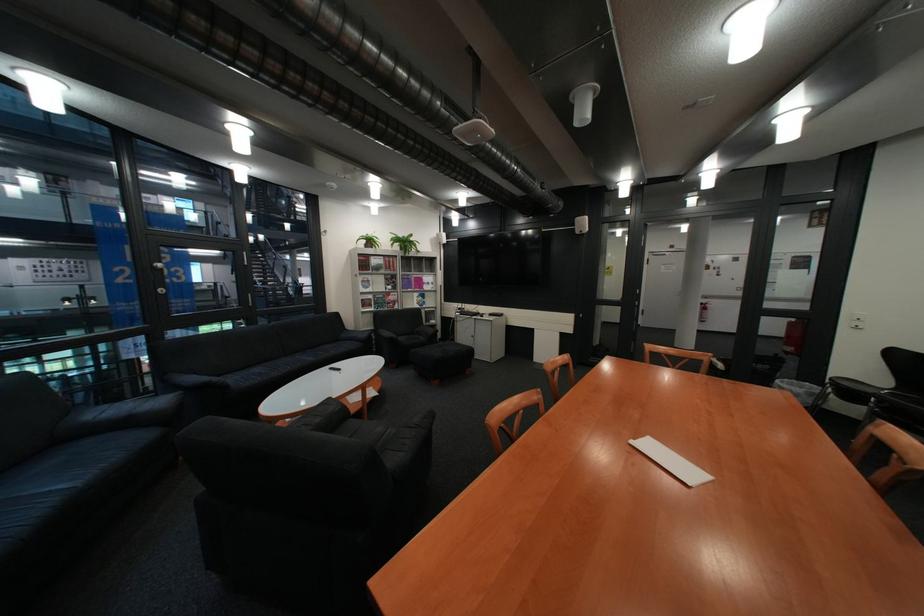
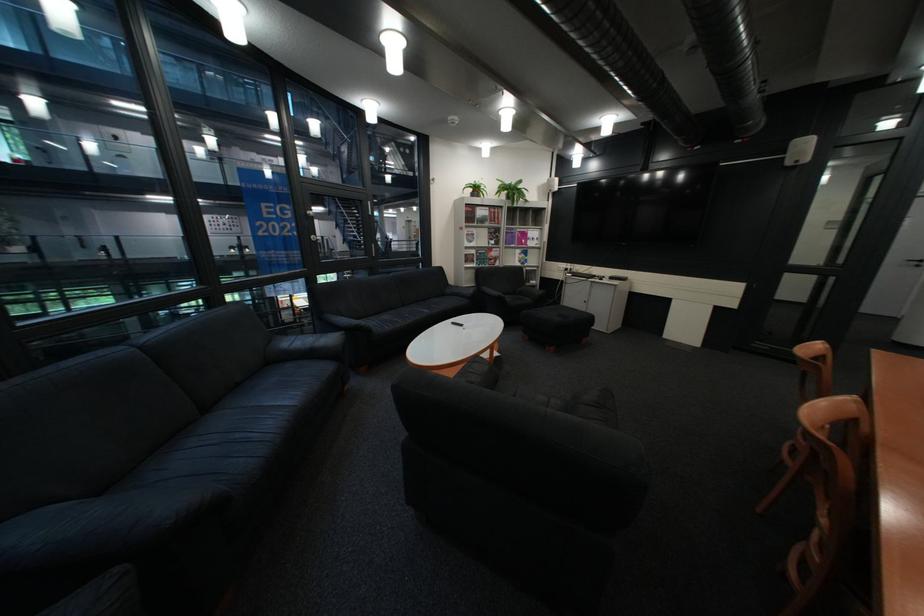
Where in the second image is the point corresponding to pixel 141 424 from the first image?

(325, 354)